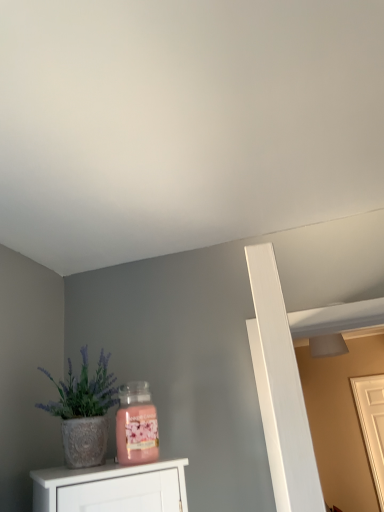
What is the approximate width of white wooden door at right?

2.69 inches.

Describe the element at coordinates (372, 424) in the screenshot. The width and height of the screenshot is (384, 512). I see `white wooden door at right` at that location.

Identify the location of white wooden door at right. [x=372, y=424].

Image resolution: width=384 pixels, height=512 pixels. What do you see at coordinates (84, 411) in the screenshot?
I see `textured white pot at left` at bounding box center [84, 411].

Find the location of `textured white pot at left`. textured white pot at left is located at coordinates (84, 411).

Locate an element on the screen. The width and height of the screenshot is (384, 512). white wooden door at right is located at coordinates (372, 424).

Which is more to the right, white wooden door at right or textured white pot at left?

From the viewer's perspective, white wooden door at right appears more on the right side.

Does white wooden door at right come behind textured white pot at left?

That is True.

Considering the positions of point (361, 381) and point (72, 383), is point (361, 381) closer or farther from the camera than point (72, 383)?

Point (361, 381) is farther from the camera than point (72, 383).

Looking at this image, from the image's perspective, is white wooden door at right below textured white pot at left?

Correct, white wooden door at right appears lower than textured white pot at left in the image.

From a real-world perspective, is white wooden door at right below textured white pot at left?

Yes, from a real-world perspective, white wooden door at right is below textured white pot at left.

Is white wooden door at right wider or thinner than textured white pot at left?

A: In the image, white wooden door at right appears to be more narrow than textured white pot at left.

In terms of height, does white wooden door at right look taller or shorter compared to textured white pot at left?

In the image, white wooden door at right appears to be taller than textured white pot at left.

Does white wooden door at right have a larger size compared to textured white pot at left?

Correct, white wooden door at right is larger in size than textured white pot at left.

Consider the image. Is white wooden door at right outside of textured white pot at left?

Indeed, white wooden door at right is completely outside textured white pot at left.

Can you see white wooden door at right touching textured white pot at left?

No, white wooden door at right is not next to textured white pot at left.

Is white wooden door at right positioned with its back to textured white pot at left?

white wooden door at right does not have its back to textured white pot at left.

How different are the orientations of white wooden door at right and textured white pot at left in degrees?

There is a 39.3-degree angle between the facing directions of white wooden door at right and textured white pot at left.

Identify the location of door that is under the textured white pot at left (from a real-world perspective). (372, 424).

Can you confirm if textured white pot at left is positioned to the left of white wooden door at right?

Indeed, textured white pot at left is positioned on the left side of white wooden door at right.

Is textured white pot at left closer to the viewer compared to white wooden door at right?

Yes, textured white pot at left is in front of white wooden door at right.

Which is less distant, (91, 394) or (368, 438)?

Point (91, 394)

From the image's perspective, is textured white pot at left located beneath white wooden door at right?

No.

From a real-world perspective, is textured white pot at left positioned over white wooden door at right based on gravity?

Yes, from a real-world perspective, textured white pot at left is above white wooden door at right.

Which object is wider, textured white pot at left or white wooden door at right?

textured white pot at left.

Can you confirm if textured white pot at left is taller than white wooden door at right?

In fact, textured white pot at left may be shorter than white wooden door at right.

Considering the sizes of objects textured white pot at left and white wooden door at right in the image provided, who is smaller, textured white pot at left or white wooden door at right?

textured white pot at left.

Is textured white pot at left located outside white wooden door at right?

Indeed, textured white pot at left is completely outside white wooden door at right.

Is textured white pot at left far away from white wooden door at right?

That's right, there is a large distance between textured white pot at left and white wooden door at right.

Is textured white pot at left oriented towards white wooden door at right?

No, textured white pot at left does not turn towards white wooden door at right.

How distant is textured white pot at left from white wooden door at right?

textured white pot at left and white wooden door at right are 12.08 feet apart.

Locate an element on the screen. The image size is (384, 512). houseplant lying above the white wooden door at right (from the image's perspective) is located at coordinates (84, 411).

Where is `door behind the textured white pot at left`? The image size is (384, 512). door behind the textured white pot at left is located at coordinates (372, 424).

This screenshot has height=512, width=384. What are the coordinates of `door on the right of textured white pot at left` in the screenshot? It's located at (372, 424).